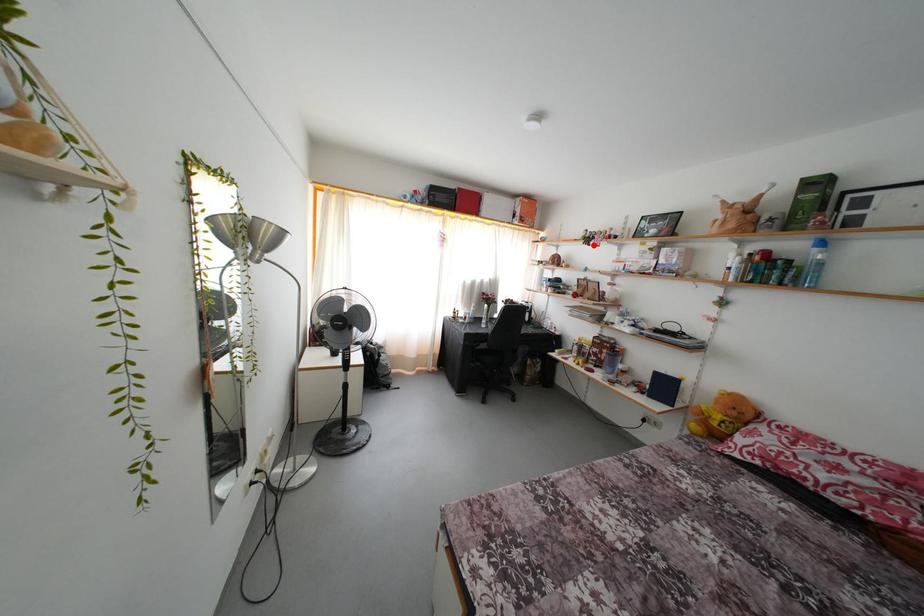
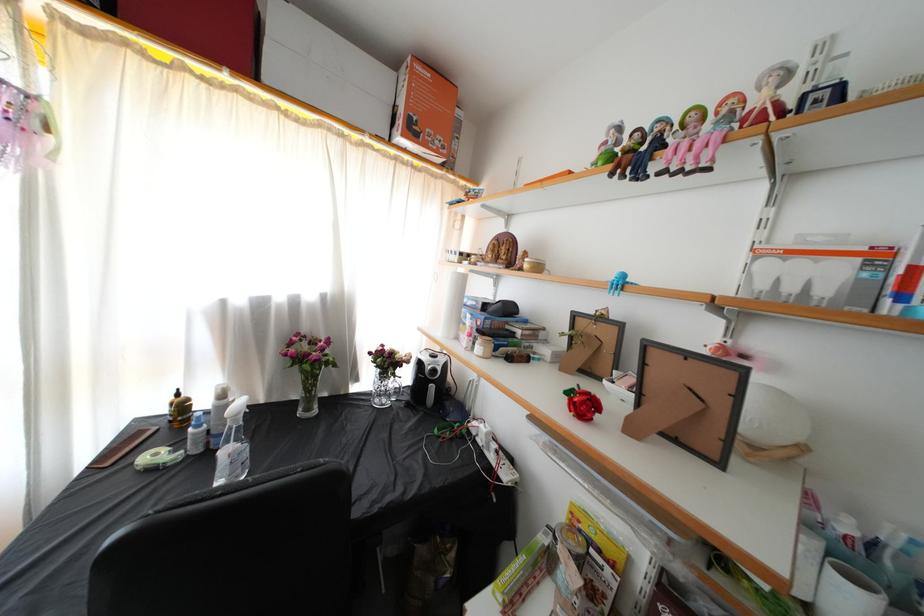
Find the pixel in the second image that matches the highlighted location in the first image.

(638, 161)